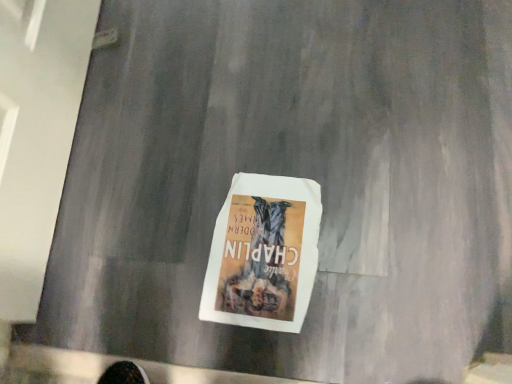
The height and width of the screenshot is (384, 512). What do you see at coordinates (263, 253) in the screenshot?
I see `white paper at center` at bounding box center [263, 253].

What are the coordinates of `white paper at center` in the screenshot? It's located at (263, 253).

At what (x,y) coordinates should I click in order to perform the action: click on white paper at center. Please return your answer as a coordinate pair (x, y). Image resolution: width=512 pixels, height=384 pixels. Looking at the image, I should click on (263, 253).